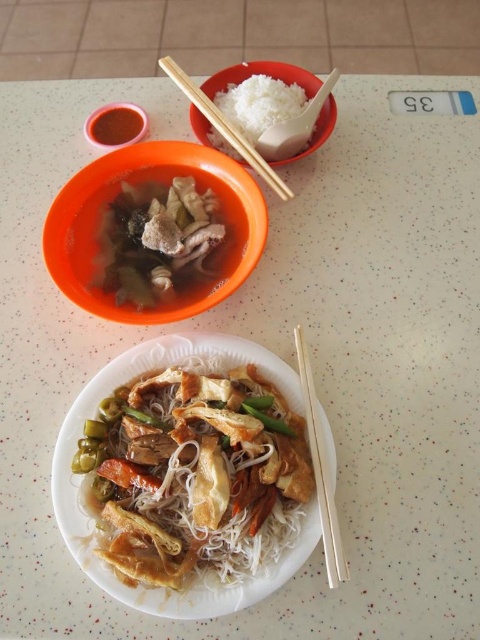
Can you confirm if orange plastic bowl at upper center is bigger than white matte rice at upper center?

Indeed, orange plastic bowl at upper center has a larger size compared to white matte rice at upper center.

Is point (43, 230) closer to camera compared to point (257, 132)?

Yes, point (43, 230) is closer to viewer.

Image resolution: width=480 pixels, height=640 pixels. In order to click on orange plastic bowl at upper center in this screenshot , I will do `click(144, 186)`.

Is point (217, 538) farther from camera compared to point (106, 275)?

No.

Does shiny brown noodles at center have a greater height compared to dark brown meaty broth at upper center?

Yes, shiny brown noodles at center is taller than dark brown meaty broth at upper center.

Between point (199, 540) and point (202, 243), which one is positioned behind?

The point (202, 243) is more distant.

The image size is (480, 640). Find the location of `shiny brown noodles at center`. shiny brown noodles at center is located at coordinates (192, 474).

Which is in front, point (342, 566) or point (133, 125)?

Point (342, 566) is more forward.

Is point (335, 564) positioned in front of point (116, 134)?

Yes, it is in front of point (116, 134).

In order to click on white wood chopsticks at center in this screenshot , I will do point(321,472).